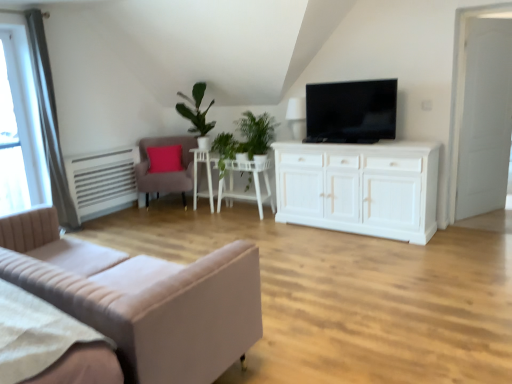
Question: From the image's perspective, is white glossy side table at center on top of white wooden door at right?

Choices:
 (A) yes
 (B) no

Answer: (B)

Question: Is white glossy side table at center facing away from white wooden door at right?

Choices:
 (A) yes
 (B) no

Answer: (B)

Question: Does white glossy side table at center have a greater width compared to white wooden door at right?

Choices:
 (A) yes
 (B) no

Answer: (A)

Question: Considering the relative positions of white glossy side table at center and white wooden door at right in the image provided, is white glossy side table at center to the left of white wooden door at right from the viewer's perspective?

Choices:
 (A) yes
 (B) no

Answer: (A)

Question: Would you say white wooden door at right is part of white glossy side table at center's contents?

Choices:
 (A) no
 (B) yes

Answer: (A)

Question: From the image's perspective, is beige fabric studio couch at lower left located above or below green leafy plant at center?

Choices:
 (A) above
 (B) below

Answer: (B)

Question: In the image, is beige fabric studio couch at lower left positioned in front of or behind green leafy plant at center?

Choices:
 (A) front
 (B) behind

Answer: (A)

Question: Based on their sizes in the image, would you say beige fabric studio couch at lower left is bigger or smaller than green leafy plant at center?

Choices:
 (A) big
 (B) small

Answer: (A)

Question: Does point (39, 273) appear closer or farther from the camera than point (244, 125)?

Choices:
 (A) closer
 (B) farther

Answer: (A)

Question: In terms of height, does white glossy side table at center look taller or shorter compared to green leafy plant at center?

Choices:
 (A) short
 (B) tall

Answer: (B)

Question: In terms of size, does white glossy side table at center appear bigger or smaller than green leafy plant at center?

Choices:
 (A) small
 (B) big

Answer: (A)

Question: Considering the positions of white glossy side table at center and green leafy plant at center in the image, is white glossy side table at center wider or thinner than green leafy plant at center?

Choices:
 (A) thin
 (B) wide

Answer: (A)

Question: Is point (200, 158) closer or farther from the camera than point (219, 152)?

Choices:
 (A) farther
 (B) closer

Answer: (A)

Question: Is point (260, 142) positioned closer to the camera than point (208, 321)?

Choices:
 (A) farther
 (B) closer

Answer: (A)

Question: Is green leafy plant at center bigger or smaller than beige fabric studio couch at lower left?

Choices:
 (A) small
 (B) big

Answer: (A)